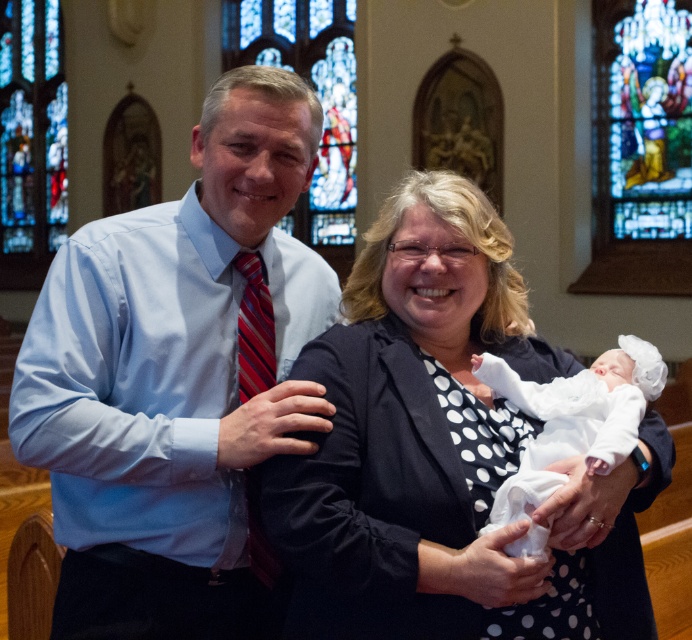
Is white satin newborn at center above stained glass window at upper center?

No.

Can you confirm if white satin newborn at center is thinner than stained glass window at upper center?

Yes, white satin newborn at center is thinner than stained glass window at upper center.

Where is `white satin newborn at center`? The image size is (692, 640). white satin newborn at center is located at coordinates (573, 419).

The height and width of the screenshot is (640, 692). What are the coordinates of `matte blue shirt at center` in the screenshot? It's located at (179, 376).

Is point (291, 481) positioned before point (19, 40)?

That is True.

Which is below, white dotted fabric at center or stained glass window at upper left?

Positioned lower is white dotted fabric at center.

Locate an element on the screen. This screenshot has height=640, width=692. white dotted fabric at center is located at coordinates (446, 452).